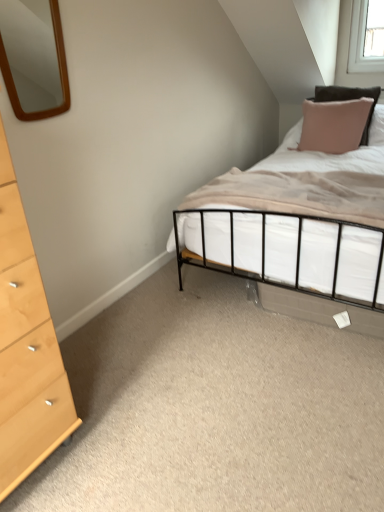
Question: Is pink fabric pillow at upper right beside light wood/texture chest of drawers at left?

Choices:
 (A) no
 (B) yes

Answer: (A)

Question: From the image's perspective, is pink fabric pillow at upper right over light wood/texture chest of drawers at left?

Choices:
 (A) no
 (B) yes

Answer: (B)

Question: Is pink fabric pillow at upper right located outside light wood/texture chest of drawers at left?

Choices:
 (A) yes
 (B) no

Answer: (A)

Question: Does pink fabric pillow at upper right appear on the left side of light wood/texture chest of drawers at left?

Choices:
 (A) yes
 (B) no

Answer: (B)

Question: Is pink fabric pillow at upper right smaller than light wood/texture chest of drawers at left?

Choices:
 (A) yes
 (B) no

Answer: (A)

Question: Considering the relative sizes of pink fabric pillow at upper right and light wood/texture chest of drawers at left in the image provided, is pink fabric pillow at upper right thinner than light wood/texture chest of drawers at left?

Choices:
 (A) no
 (B) yes

Answer: (B)

Question: Can we say wooden mirror at upper left lies outside pink fabric pillow at upper right?

Choices:
 (A) yes
 (B) no

Answer: (A)

Question: Can you confirm if wooden mirror at upper left is wider than pink fabric pillow at upper right?

Choices:
 (A) yes
 (B) no

Answer: (B)

Question: Is pink fabric pillow at upper right completely or partially inside wooden mirror at upper left?

Choices:
 (A) yes
 (B) no

Answer: (B)

Question: Does wooden mirror at upper left have a lesser width compared to pink fabric pillow at upper right?

Choices:
 (A) yes
 (B) no

Answer: (A)

Question: Does wooden mirror at upper left have a larger size compared to pink fabric pillow at upper right?

Choices:
 (A) no
 (B) yes

Answer: (A)

Question: Is pink fabric pillow at upper right at the back of wooden mirror at upper left?

Choices:
 (A) no
 (B) yes

Answer: (A)

Question: Would you say wooden mirror at upper left is part of pink fabric pillow at upper right's contents?

Choices:
 (A) no
 (B) yes

Answer: (A)